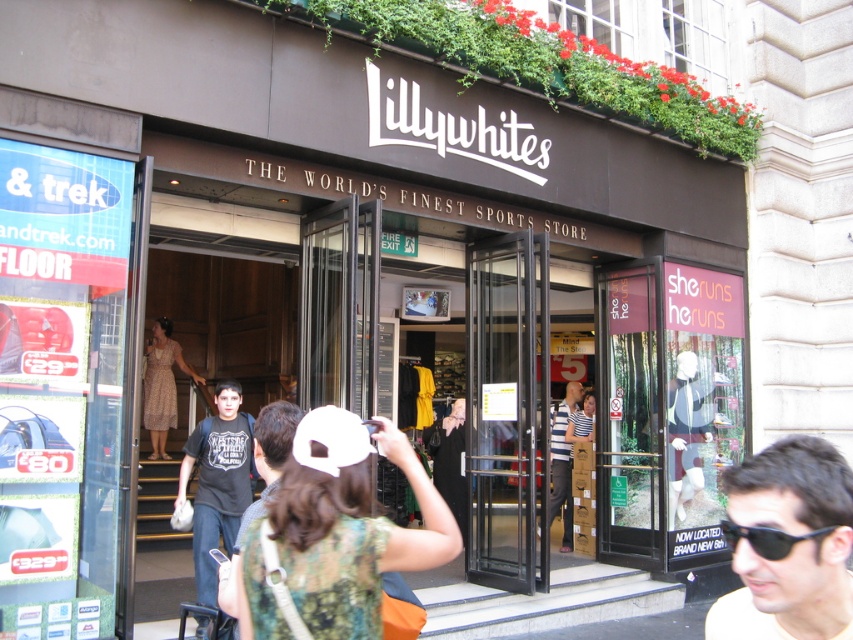
Which is in front, point (804, 440) or point (265, 486)?

Positioned in front is point (804, 440).

Identify the location of black matte sunglasses at lower right. (788, 544).

Image resolution: width=853 pixels, height=640 pixels. I want to click on black matte sunglasses at lower right, so click(788, 544).

Is point (437, 516) positioned in front of point (781, 541)?

No, (437, 516) is behind (781, 541).

What do you see at coordinates (337, 531) in the screenshot?
I see `camouflage fabric cap at center` at bounding box center [337, 531].

Measure the distance between camouflage fabric cap at center and camera.

camouflage fabric cap at center and camera are 2.33 meters apart.

The height and width of the screenshot is (640, 853). I want to click on camouflage fabric cap at center, so click(337, 531).

Can you confirm if dark gray t-shirt at center is bigger than dark gray cotton t-shirt at center?

Yes, dark gray t-shirt at center is bigger than dark gray cotton t-shirt at center.

Can you confirm if dark gray t-shirt at center is smaller than dark gray cotton t-shirt at center?

No.

Between point (212, 512) and point (277, 406), which one is positioned in front?

Positioned in front is point (277, 406).

What are the coordinates of `dark gray t-shirt at center` in the screenshot? It's located at (218, 483).